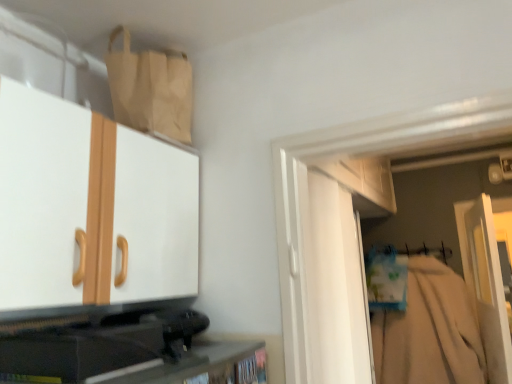
Question: Based on their sizes in the image, would you say black plastic speaker at lower left, acting as the first cabinetry starting from the bottom, is bigger or smaller than white fabric hanger at right?

Choices:
 (A) big
 (B) small

Answer: (B)

Question: Considering the relative positions of black plastic speaker at lower left, the 2th cabinetry from the top, and white fabric hanger at right in the image provided, is black plastic speaker at lower left, the 2th cabinetry from the top, to the left or to the right of white fabric hanger at right?

Choices:
 (A) left
 (B) right

Answer: (A)

Question: Based on their relative distances, which object is nearer to the matte beige paper bag at upper left?

Choices:
 (A) beige cotton robe at right
 (B) white matte door at center
 (C) white fabric hanger at right
 (D) matte white cabinet at upper left, the 1th cabinetry in the top-to-bottom sequence
 (E) black plastic speaker at lower left, the 2th cabinetry from the top

Answer: (D)

Question: Which object is positioned closest to the matte white cabinet at upper left, which ranks as the 2th cabinetry in bottom-to-top order?

Choices:
 (A) matte beige paper bag at upper left
 (B) black plastic speaker at lower left, the 2th cabinetry from the top
 (C) white fabric hanger at right
 (D) beige cotton robe at right
 (E) white matte door at center

Answer: (A)